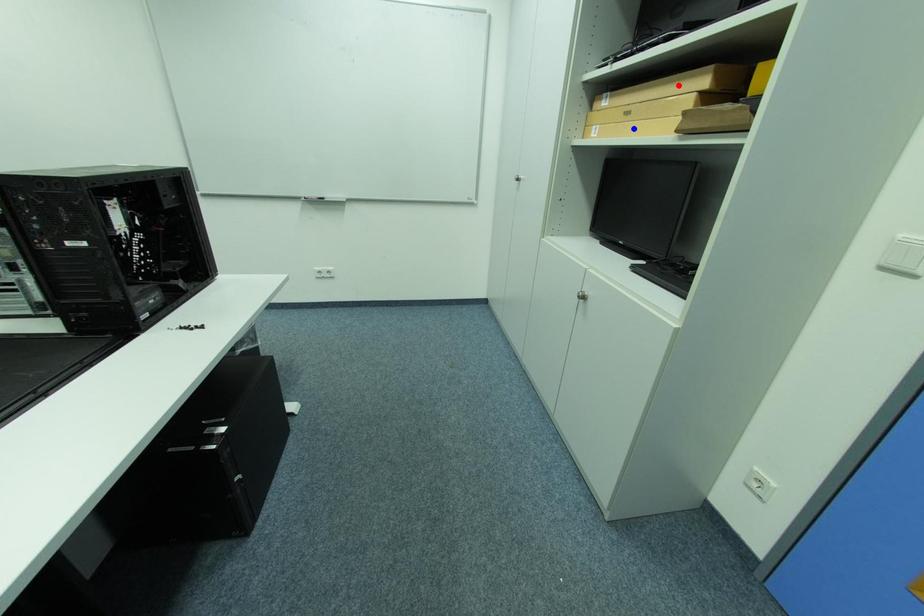
Question: Two points are marked on the image. Which point is closer to the camera?

Choices:
 (A) Blue point is closer.
 (B) Red point is closer.

Answer: (B)